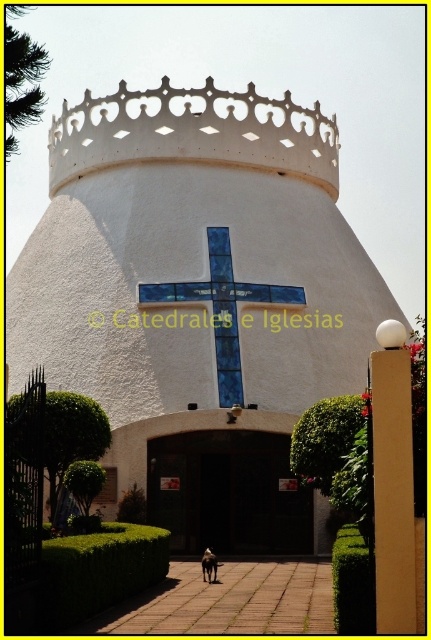
Question: Is white textured dome at center to the right of blue glass cross at center from the viewer's perspective?

Choices:
 (A) yes
 (B) no

Answer: (B)

Question: Which point appears farthest from the camera in this image?

Choices:
 (A) (302, 298)
 (B) (324, 186)

Answer: (B)

Question: Which of the following is the closest to the observer?

Choices:
 (A) dark brown wooden door at center
 (B) white textured crown at upper center
 (C) white textured dome at center
 (D) blue glass cross at center

Answer: (C)

Question: In this image, where is white textured crown at upper center located relative to dark brown wooden door at center?

Choices:
 (A) above
 (B) below

Answer: (A)

Question: Which of these objects is positioned farthest from the white textured crown at upper center?

Choices:
 (A) blue glass cross at center
 (B) dark brown wooden door at center

Answer: (B)

Question: Does dark brown wooden door at center have a smaller size compared to blue glass cross at center?

Choices:
 (A) no
 (B) yes

Answer: (B)